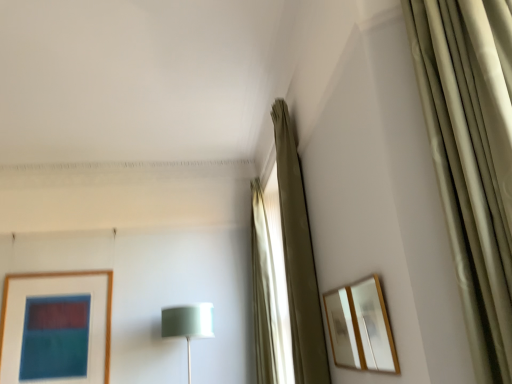
Question: Is satin green shade at center thinner than beige fabric curtain at center, which is the second curtain from front to back?

Choices:
 (A) no
 (B) yes

Answer: (A)

Question: Are satin green shade at center and beige fabric curtain at center, which ranks as the 1th curtain in back-to-front order, far apart?

Choices:
 (A) no
 (B) yes

Answer: (A)

Question: Considering the relative sizes of satin green shade at center and beige fabric curtain at center, which is the second curtain from front to back, in the image provided, is satin green shade at center smaller than beige fabric curtain at center, which is the second curtain from front to back,?

Choices:
 (A) no
 (B) yes

Answer: (A)

Question: Is satin green shade at center at the right side of beige fabric curtain at center, which is the second curtain from front to back?

Choices:
 (A) no
 (B) yes

Answer: (A)

Question: From the image's perspective, is satin green shade at center located above beige fabric curtain at center, which ranks as the 1th curtain in back-to-front order?

Choices:
 (A) no
 (B) yes

Answer: (A)

Question: Considering the positions of satin green shade at center and wooden-framed mirror at right, the first picture frame positioned from the front, in the image, is satin green shade at center wider or thinner than wooden-framed mirror at right, the first picture frame positioned from the front,?

Choices:
 (A) wide
 (B) thin

Answer: (A)

Question: From a real-world perspective, is satin green shade at center positioned above or below wooden-framed mirror at right, the second picture frame positioned from the back?

Choices:
 (A) below
 (B) above

Answer: (A)

Question: Do you think satin green shade at center is within wooden-framed mirror at right, the second picture frame positioned from the back, or outside of it?

Choices:
 (A) inside
 (B) outside

Answer: (B)

Question: In terms of size, does satin green shade at center appear bigger or smaller than wooden-framed mirror at right, the first picture frame positioned from the front?

Choices:
 (A) big
 (B) small

Answer: (A)

Question: Is point (349, 340) closer or farther from the camera than point (186, 331)?

Choices:
 (A) farther
 (B) closer

Answer: (B)

Question: In the image, is wooden-framed mirror at right, the second picture frame positioned from the back, positioned in front of or behind satin green shade at center?

Choices:
 (A) behind
 (B) front

Answer: (B)

Question: Is wooden-framed mirror at right, the second picture frame positioned from the back, spatially inside satin green shade at center, or outside of it?

Choices:
 (A) inside
 (B) outside

Answer: (B)

Question: From the image's perspective, is wooden-framed mirror at right, the first picture frame positioned from the front, located above or below satin green shade at center?

Choices:
 (A) above
 (B) below

Answer: (A)

Question: Considering the positions of point (279, 135) and point (172, 329), is point (279, 135) closer or farther from the camera than point (172, 329)?

Choices:
 (A) closer
 (B) farther

Answer: (A)

Question: Is beige fabric curtain at upper right, acting as the second curtain starting from the back, bigger or smaller than satin green shade at center?

Choices:
 (A) big
 (B) small

Answer: (B)